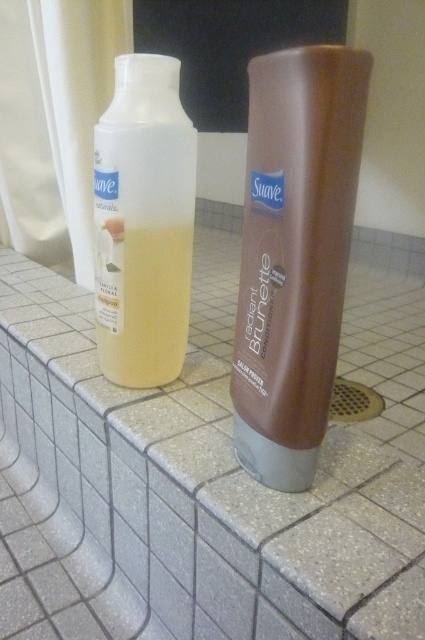
Which is behind, point (258, 125) or point (125, 67)?

The point (125, 67) is more distant.

Is brown matte shampoo at center positioned behind translucent plastic shampoo at left?

That is False.

Is point (286, 97) less distant than point (167, 355)?

Yes, point (286, 97) is in front of point (167, 355).

At what (x,y) coordinates should I click in order to perform the action: click on brown matte shampoo at center. Please return your answer as a coordinate pair (x, y). The height and width of the screenshot is (640, 425). Looking at the image, I should click on (294, 253).

From the picture: Does gray speckled tile at center lie in front of brown matte shampoo at center?

Yes, gray speckled tile at center is in front of brown matte shampoo at center.

Is gray speckled tile at center shorter than brown matte shampoo at center?

Incorrect, gray speckled tile at center's height does not fall short of brown matte shampoo at center's.

I want to click on gray speckled tile at center, so click(229, 461).

This screenshot has height=640, width=425. I want to click on gray speckled tile at center, so click(x=229, y=461).

Can you confirm if gray speckled tile at center is positioned to the right of translucent plastic shampoo at left?

Yes, gray speckled tile at center is to the right of translucent plastic shampoo at left.

Does gray speckled tile at center have a greater height compared to translucent plastic shampoo at left?

Correct, gray speckled tile at center is much taller as translucent plastic shampoo at left.

Who is more distant from viewer, (11, 294) or (170, 86)?

The point (11, 294) is behind.

At what (x,y) coordinates should I click in order to perform the action: click on gray speckled tile at center. Please return your answer as a coordinate pair (x, y). Image resolution: width=425 pixels, height=640 pixels. Looking at the image, I should click on (229, 461).